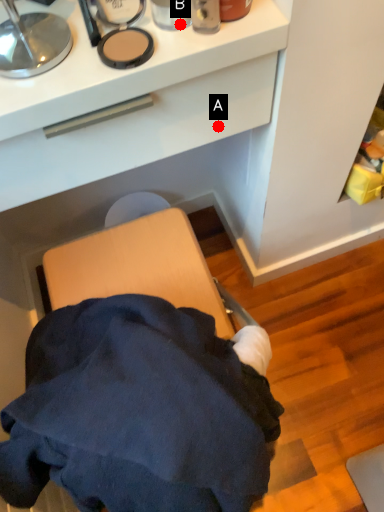
Question: Two points are circled on the image, labeled by A and B beside each circle. Which point appears farthest from the camera in this image?

Choices:
 (A) A is further
 (B) B is further

Answer: (A)